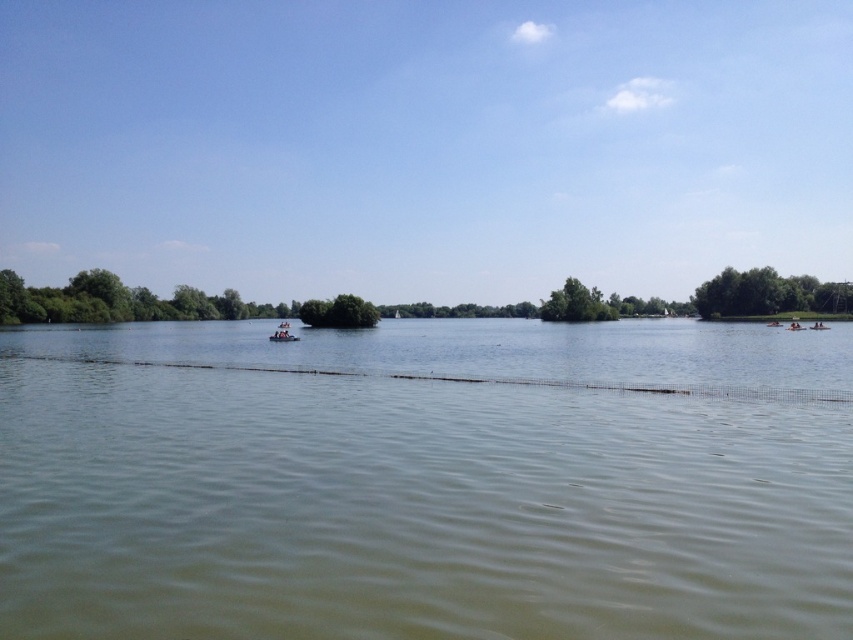
Question: Is the position of green murky water at center less distant than that of green leafy island at center?

Choices:
 (A) no
 (B) yes

Answer: (B)

Question: Is green leafy tree at center above green leafy island at center?

Choices:
 (A) no
 (B) yes

Answer: (B)

Question: Does green leafy trees at right appear under green leafy island at center?

Choices:
 (A) no
 (B) yes

Answer: (A)

Question: Which point appears closest to the camera in this image?

Choices:
 (A) (286, 330)
 (B) (601, 307)

Answer: (A)

Question: Which object is farther from the camera taking this photo?

Choices:
 (A) green leafy trees at right
 (B) wooden raft at center
 (C) green murky water at center
 (D) green leafy island at center

Answer: (A)

Question: Which of the following is the farthest from the observer?

Choices:
 (A) (602, 314)
 (B) (723, 289)
 (C) (297, 339)
 (D) (316, 300)

Answer: (A)